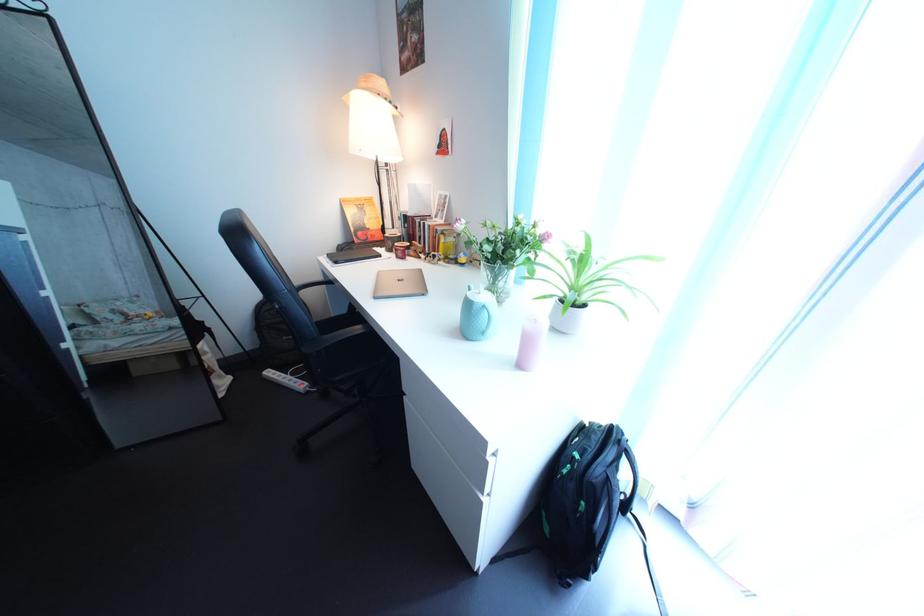
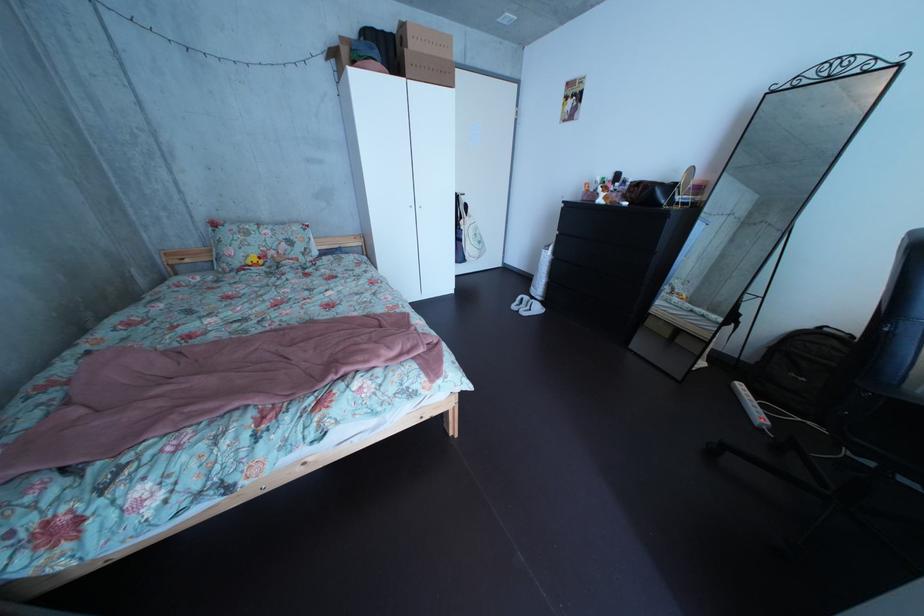
Where in the second image is the point corresponding to (x=265, y=353) from the first image?

(763, 363)